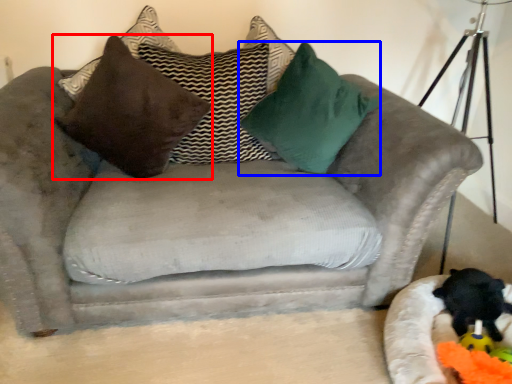
Question: Among these objects, which one is farthest to the camera, pillow (highlighted by a red box) or pillow (highlighted by a blue box)?

Choices:
 (A) pillow
 (B) pillow

Answer: (A)